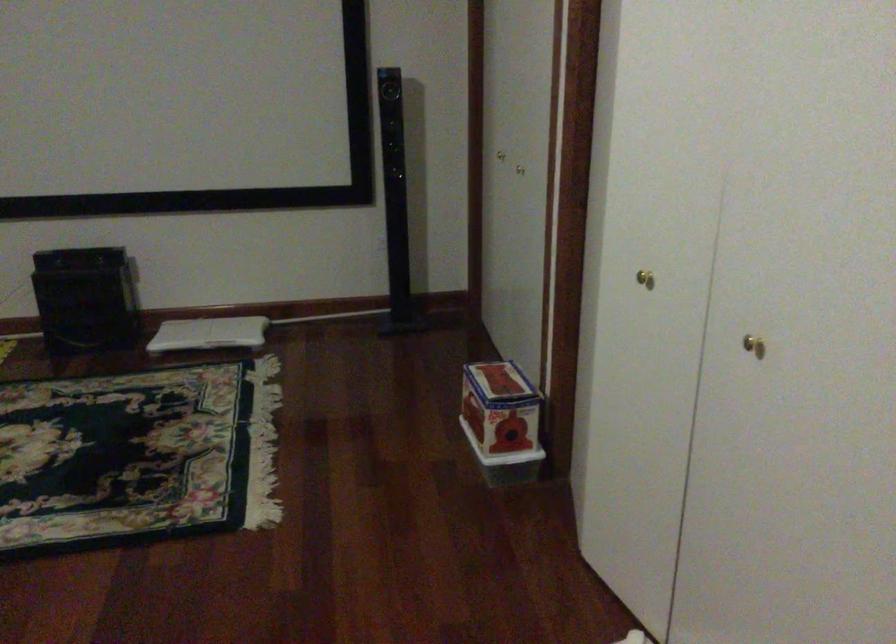
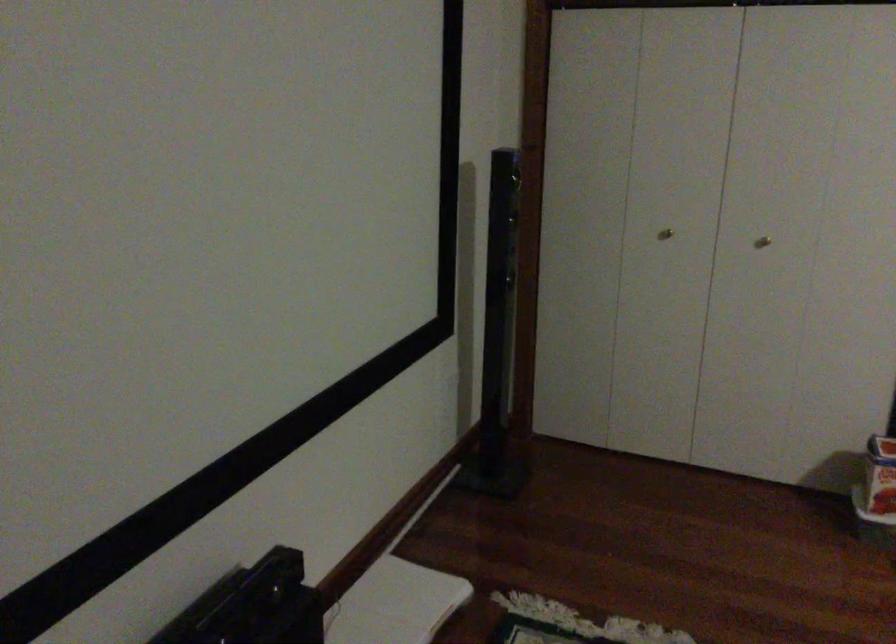
In the second image, find the point that corresponds to (493,156) in the first image.

(665, 234)